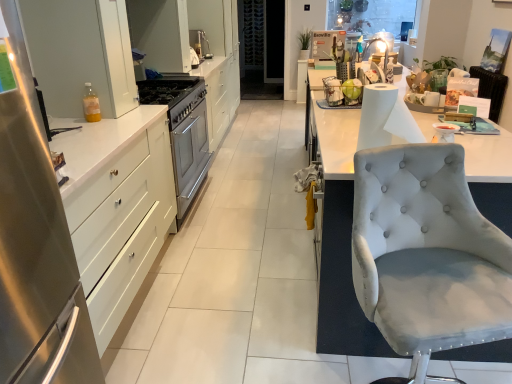
Image resolution: width=512 pixels, height=384 pixels. Identify the location of vacant space in front of white glossy cabinet at upper left, the 2th cabinetry in the top-to-bottom sequence. (88, 122).